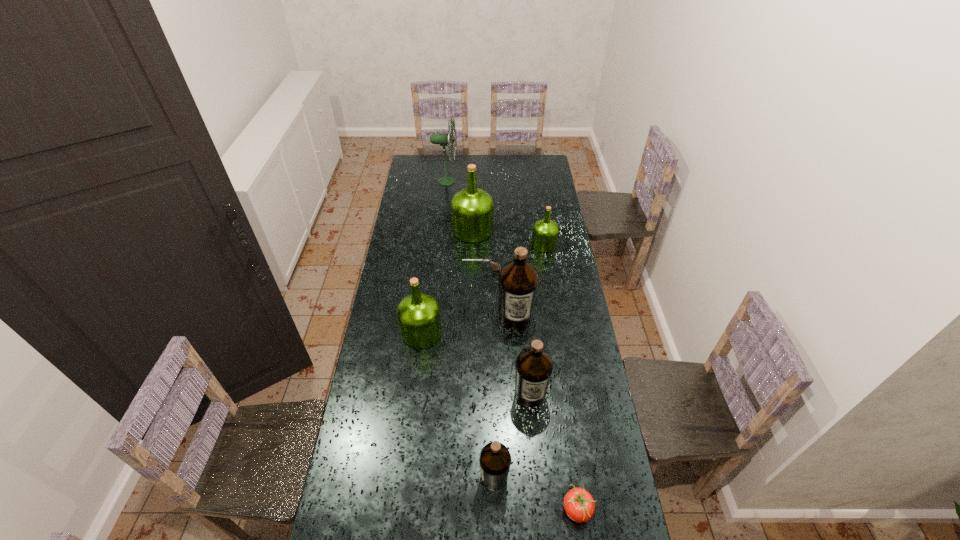
Identify which green olive oil is the closest to the nearest olive oil. Please provide its 2D coordinates. Your answer should be formatted as a tuple, i.e. [(x, y)], where the tuple contains the x and y coordinates of a point satisfying the conditions above.

[(418, 314)]

Locate which green olive oil is the closest to the leftmost green olive oil. Please provide its 2D coordinates. Your answer should be formatted as a tuple, i.e. [(x, y)], where the tuple contains the x and y coordinates of a point satisfying the conditions above.

[(472, 209)]

The image size is (960, 540). What are the coordinates of `vacant position in the image that satisfies the following two spatial constraints: 1. on the front-facing side of the green fan; 2. on the left side of the rightmost green olive oil` in the screenshot? It's located at (440, 244).

Where is `vacant area that satisfies the following two spatial constraints: 1. on the front-facing side of the farthest object; 2. on the front side of the leftmost green olive oil`? This screenshot has width=960, height=540. vacant area that satisfies the following two spatial constraints: 1. on the front-facing side of the farthest object; 2. on the front side of the leftmost green olive oil is located at coordinates (431, 332).

Find the location of `vacant space that satisfies the following two spatial constraints: 1. aiming along the barrel of the tomato; 2. on the left side of the sixth nearest object`. vacant space that satisfies the following two spatial constraints: 1. aiming along the barrel of the tomato; 2. on the left side of the sixth nearest object is located at coordinates pos(481,509).

Where is `free space that satisfies the following two spatial constraints: 1. on the back side of the red tomato; 2. on the label of the smallest brown olive oil`? free space that satisfies the following two spatial constraints: 1. on the back side of the red tomato; 2. on the label of the smallest brown olive oil is located at coordinates (572, 477).